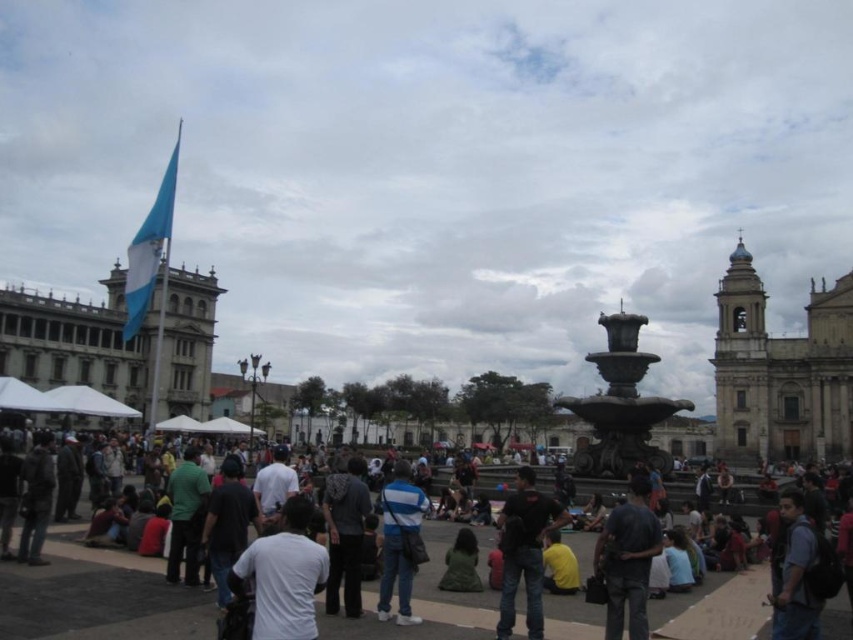
Question: Which point is farther to the camera?

Choices:
 (A) dark blue jeans at center
 (B) blue denim jeans at lower right
 (C) black matte shirt at center

Answer: (C)

Question: Is dark blue jeans at center behind dark blue shirt at center?

Choices:
 (A) yes
 (B) no

Answer: (B)

Question: Is dark blue shirt at center positioned at the back of black matte shirt at center?

Choices:
 (A) no
 (B) yes

Answer: (A)

Question: Does dark blue shirt at center have a larger size compared to striped cotton shirt at center?

Choices:
 (A) no
 (B) yes

Answer: (B)

Question: Which point is farther to the camera?

Choices:
 (A) dark blue jeans at center
 (B) striped cotton shirt at center
 (C) bronze ornate fountain at center
 (D) blue denim jeans at lower right

Answer: (C)

Question: Which point is closer to the camera?

Choices:
 (A) striped cotton shirt at center
 (B) dark blue jeans at center

Answer: (B)